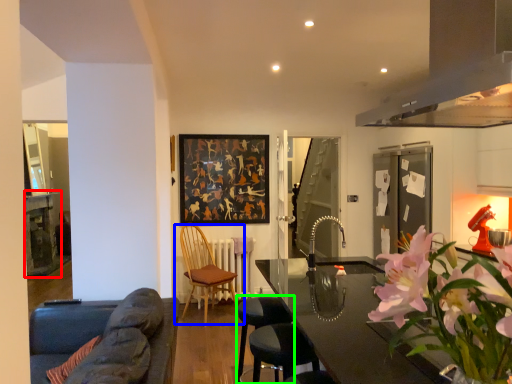
Question: Considering the real-world distances, which object is farthest from table (highlighted by a red box)? chair (highlighted by a blue box) or bar stool (highlighted by a green box)?

Choices:
 (A) chair
 (B) bar stool

Answer: (B)